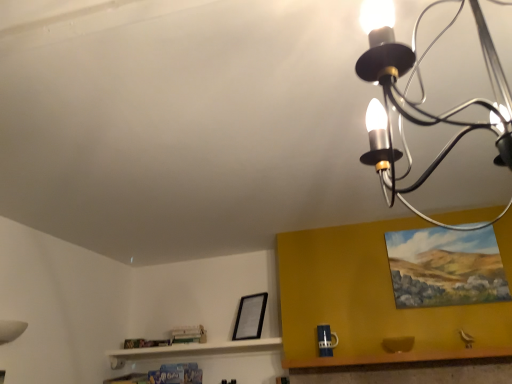
What do you see at coordinates (424, 96) in the screenshot? Image resolution: width=512 pixels, height=384 pixels. I see `black metal chandelier at upper right` at bounding box center [424, 96].

Where is `black metal chandelier at upper right`? The height and width of the screenshot is (384, 512). black metal chandelier at upper right is located at coordinates (x=424, y=96).

From a real-world perspective, is wooden table at lower right below black matte picture frame at lower center, the second picture frame in the top-to-bottom sequence?

Indeed, from a real-world perspective, wooden table at lower right is positioned beneath black matte picture frame at lower center, the second picture frame in the top-to-bottom sequence.

From the image's perspective, which one is positioned higher, wooden table at lower right or black matte picture frame at lower center, positioned as the first picture frame in bottom-to-top order?

black matte picture frame at lower center, positioned as the first picture frame in bottom-to-top order.

Which of these two, wooden table at lower right or black matte picture frame at lower center, which is counted as the 2th picture frame, starting from the right, is bigger?

wooden table at lower right is bigger.

Considering the relative positions of wooden table at lower right and black matte picture frame at lower center, positioned as the first picture frame in bottom-to-top order, in the image provided, is wooden table at lower right to the left of black matte picture frame at lower center, positioned as the first picture frame in bottom-to-top order, from the viewer's perspective?

In fact, wooden table at lower right is to the right of black matte picture frame at lower center, positioned as the first picture frame in bottom-to-top order.

Is black matte picture frame at lower center, which is counted as the 2th picture frame, starting from the right, to the right of black metal chandelier at upper right from the viewer's perspective?

In fact, black matte picture frame at lower center, which is counted as the 2th picture frame, starting from the right, is to the left of black metal chandelier at upper right.

Could you tell me if black matte picture frame at lower center, positioned as the first picture frame in bottom-to-top order, is facing black metal chandelier at upper right?

No, black matte picture frame at lower center, positioned as the first picture frame in bottom-to-top order, is not aimed at black metal chandelier at upper right.

Is black matte picture frame at lower center, the second picture frame from the front, taller than black metal chandelier at upper right?

Incorrect, the height of black matte picture frame at lower center, the second picture frame from the front, is not larger of that of black metal chandelier at upper right.

From a real-world perspective, which is physically below, black matte picture frame at lower center, the second picture frame in the top-to-bottom sequence, or black metal chandelier at upper right?

black matte picture frame at lower center, the second picture frame in the top-to-bottom sequence, is physically lower.

Is black metal chandelier at upper right a part of wooden table at lower right?

No, black metal chandelier at upper right is not surrounded by wooden table at lower right.

Does point (371, 376) appear closer or farther from the camera than point (484, 36)?

Point (371, 376).

Looking at this image, which of these two, wooden table at lower right or black metal chandelier at upper right, is thinner?

wooden table at lower right is thinner.

Considering the relative positions of wooden table at lower right and black metal chandelier at upper right in the image provided, is wooden table at lower right to the left or to the right of black metal chandelier at upper right?

wooden table at lower right is to the right of black metal chandelier at upper right.

How much distance is there between oil painting at upper right, which is counted as the 2th picture frame, starting from the left, and black matte picture frame at lower center, which is counted as the 2th picture frame, starting from the right?

They are 1.14 meters apart.

Considering the points (464, 267) and (251, 314), which point is behind, point (464, 267) or point (251, 314)?

The point (251, 314) is behind.

Is oil painting at upper right, acting as the 1th picture frame starting from the front, inside the boundaries of black matte picture frame at lower center, the second picture frame in the top-to-bottom sequence, or outside?

The correct answer is: outside.

Consider the image. From a real-world perspective, is oil painting at upper right, placed as the 1th picture frame when sorted from top to bottom, on top of black matte picture frame at lower center, the 1th picture frame when ordered from left to right?

Yes, from a real-world perspective, oil painting at upper right, placed as the 1th picture frame when sorted from top to bottom, is above black matte picture frame at lower center, the 1th picture frame when ordered from left to right.

From the image's perspective, is black matte picture frame at lower center, the 1th picture frame when ordered from back to front, located above oil painting at upper right, which is counted as the 2th picture frame, starting from the left?

No, from the image's perspective, black matte picture frame at lower center, the 1th picture frame when ordered from back to front, is not over oil painting at upper right, which is counted as the 2th picture frame, starting from the left.

Which is closer, (244, 321) or (401, 245)?

Point (401, 245)

Is black metal chandelier at upper right taller or shorter than wooden table at lower right?

Considering their sizes, black metal chandelier at upper right has more height than wooden table at lower right.

Based on their sizes in the image, would you say black metal chandelier at upper right is bigger or smaller than wooden table at lower right?

black metal chandelier at upper right is bigger than wooden table at lower right.

What's the angular difference between black metal chandelier at upper right and wooden table at lower right's facing directions?

The angular difference between black metal chandelier at upper right and wooden table at lower right is 2.03 degrees.

From a real-world perspective, is black metal chandelier at upper right above or below wooden table at lower right?

black metal chandelier at upper right is above wooden table at lower right.

Is wooden table at lower right thinner than oil painting at upper right, which ranks as the 2th picture frame in back-to-front order?

No, wooden table at lower right is not thinner than oil painting at upper right, which ranks as the 2th picture frame in back-to-front order.

Is wooden table at lower right shorter than oil painting at upper right, which ranks as the 2th picture frame in back-to-front order?

Correct, wooden table at lower right is not as tall as oil painting at upper right, which ranks as the 2th picture frame in back-to-front order.

Where is `picture frame that is the 1st object located behind the wooden table at lower right`? picture frame that is the 1st object located behind the wooden table at lower right is located at coordinates (445, 267).

This screenshot has height=384, width=512. What are the coordinates of `table located on the right of black matte picture frame at lower center, positioned as the first picture frame in bottom-to-top order` in the screenshot? It's located at (407, 368).

From the image's perspective, starting from the black metal chandelier at upper right, which picture frame is the 2nd one below? Please provide its 2D coordinates.

[(250, 317)]

In the scene shown: From the image, which object appears to be farther from black matte picture frame at lower center, the 1th picture frame when ordered from back to front, wooden table at lower right or oil painting at upper right, placed as the 1th picture frame when sorted from top to bottom?

Among the two, oil painting at upper right, placed as the 1th picture frame when sorted from top to bottom, is located further to black matte picture frame at lower center, the 1th picture frame when ordered from back to front.

Looking at the image, which one is located closer to black metal chandelier at upper right, black matte picture frame at lower center, the second picture frame from the front, or oil painting at upper right, which ranks as the 2th picture frame in back-to-front order?

Based on the image, oil painting at upper right, which ranks as the 2th picture frame in back-to-front order, appears to be nearer to black metal chandelier at upper right.

Estimate the real-world distances between objects in this image. Which object is further from black matte picture frame at lower center, the second picture frame from the front, wooden table at lower right or black metal chandelier at upper right?

black metal chandelier at upper right lies further to black matte picture frame at lower center, the second picture frame from the front, than the other object.

From the picture: Which object lies nearer to the anchor point black metal chandelier at upper right, wooden table at lower right or oil painting at upper right, the second picture frame from the bottom?

oil painting at upper right, the second picture frame from the bottom.

Estimate the real-world distances between objects in this image. Which object is further from oil painting at upper right, which ranks as the 1th picture frame in right-to-left order, black metal chandelier at upper right or wooden table at lower right?

black metal chandelier at upper right is positioned further to the anchor oil painting at upper right, which ranks as the 1th picture frame in right-to-left order.

In the scene shown: Which object lies nearer to the anchor point wooden table at lower right, black matte picture frame at lower center, which is counted as the 2th picture frame, starting from the right, or oil painting at upper right, placed as the 1th picture frame when sorted from top to bottom?

oil painting at upper right, placed as the 1th picture frame when sorted from top to bottom.

Based on their spatial positions, is black metal chandelier at upper right or wooden table at lower right further from black matte picture frame at lower center, the second picture frame in the top-to-bottom sequence?

black metal chandelier at upper right.

Based on their spatial positions, is black matte picture frame at lower center, the 1th picture frame when ordered from back to front, or black metal chandelier at upper right further from oil painting at upper right, which is counted as the 2th picture frame, starting from the left?

Among the two, black matte picture frame at lower center, the 1th picture frame when ordered from back to front, is located further to oil painting at upper right, which is counted as the 2th picture frame, starting from the left.

This screenshot has width=512, height=384. In order to click on table between black metal chandelier at upper right and black matte picture frame at lower center, the second picture frame from the front, along the z-axis in this screenshot , I will do `click(407, 368)`.

Locate an element on the screen. The width and height of the screenshot is (512, 384). picture frame between black metal chandelier at upper right and black matte picture frame at lower center, the 1th picture frame when ordered from left to right, in the front-back direction is located at coordinates (445, 267).

You are a GUI agent. You are given a task and a screenshot of the screen. Output one action in this format:
    pyautogui.click(x=<x>, y=<y>)
    Task: Click on the table situated between black matte picture frame at lower center, the second picture frame from the front, and oil painting at upper right, acting as the 1th picture frame starting from the front, from left to right
    The width and height of the screenshot is (512, 384).
    Given the screenshot: What is the action you would take?
    (407, 368)

Image resolution: width=512 pixels, height=384 pixels. Identify the location of table positioned between black metal chandelier at upper right and oil painting at upper right, placed as the 1th picture frame when sorted from top to bottom, from near to far. (407, 368).